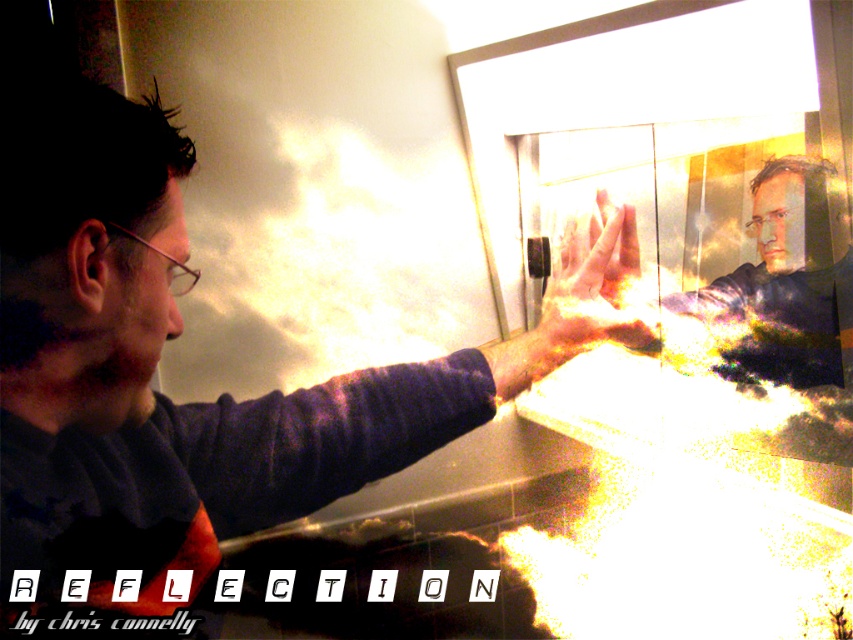
Question: Can you confirm if matte black face at upper right is wider than translucent glass hand at center?

Choices:
 (A) no
 (B) yes

Answer: (B)

Question: Is matte black hand at center positioned behind translucent glass hand at center?

Choices:
 (A) no
 (B) yes

Answer: (A)

Question: Which of these objects is positioned closest to the matte black face at upper right?

Choices:
 (A) matte black hand at center
 (B) translucent glass hand at center

Answer: (A)

Question: Based on their relative distances, which object is farther from the matte black face at upper right?

Choices:
 (A) translucent glass hand at center
 (B) matte black hand at center

Answer: (A)

Question: Does matte black hand at center appear over translucent glass hand at center?

Choices:
 (A) yes
 (B) no

Answer: (B)

Question: Which object is farther from the camera taking this photo?

Choices:
 (A) translucent glass hand at center
 (B) matte black hand at center
 (C) matte black face at upper right

Answer: (C)